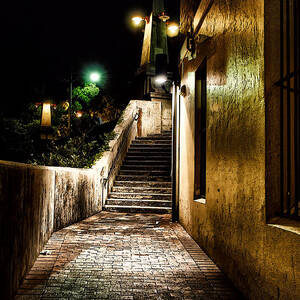
You are a GUI agent. You are given a task and a screenshot of the screen. Output one action in this format:
    pyautogui.click(x=<x>, y=<y>)
    Task: Click on the wall on right
    The height and width of the screenshot is (300, 300).
    Given the screenshot: What is the action you would take?
    pyautogui.click(x=179, y=215), pyautogui.click(x=262, y=246)